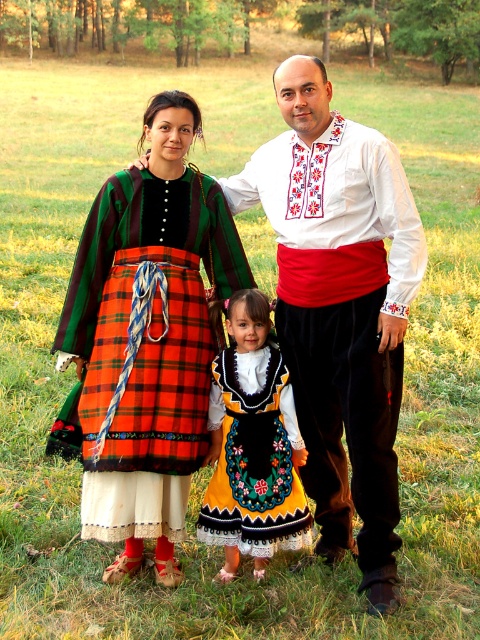
Does plaid fabric dress at center have a smaller size compared to embroidered cotton shirt at center?

Yes.

Who is positioned more to the right, plaid fabric dress at center or embroidered cotton shirt at center?

From the viewer's perspective, embroidered cotton shirt at center appears more on the right side.

This screenshot has height=640, width=480. What are the coordinates of `plaid fabric dress at center` in the screenshot? It's located at (147, 337).

Can you confirm if plaid fabric dress at center is taller than embroidered cotton dress at center?

Indeed, plaid fabric dress at center has a greater height compared to embroidered cotton dress at center.

Does plaid fabric dress at center have a lesser height compared to embroidered cotton dress at center?

In fact, plaid fabric dress at center may be taller than embroidered cotton dress at center.

Which is behind, point (119, 204) or point (268, 435)?

Point (119, 204)

Find the location of a particular element. plaid fabric dress at center is located at coordinates (147, 337).

Is point (396, 291) positioned in front of point (223, 445)?

Yes, it is in front of point (223, 445).

Is embroidered cotton shirt at center thinner than embroidered cotton dress at center?

No, embroidered cotton shirt at center is not thinner than embroidered cotton dress at center.

Locate an element on the screen. embroidered cotton shirt at center is located at coordinates (340, 312).

Locate an element on the screen. The height and width of the screenshot is (640, 480). embroidered cotton shirt at center is located at coordinates (340, 312).